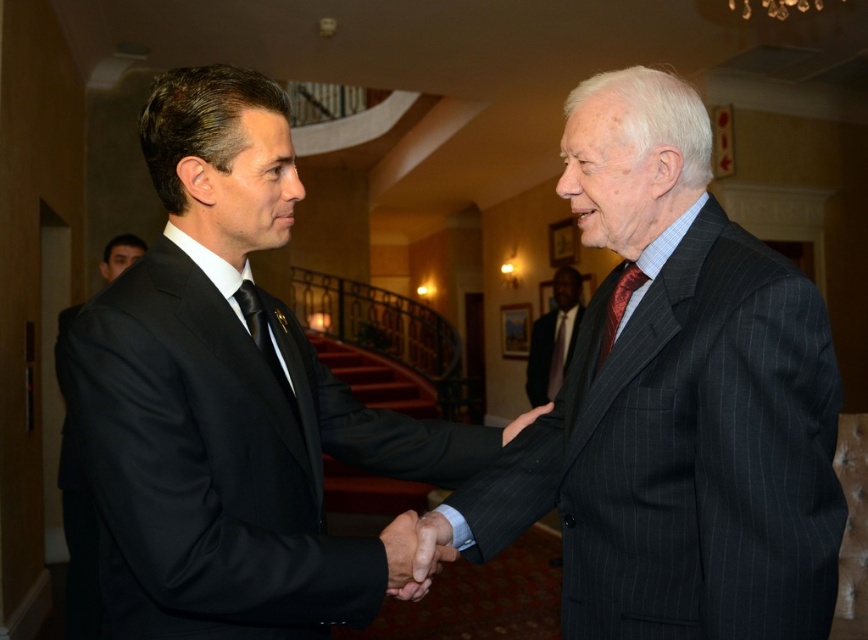
You are standing in the room and want to determine which of the two points, point (408, 528) or point (525, 416), is closer to you. Based on the scene description, which point is nearer?

Point (408, 528) is closer to the camera than point (525, 416), so it is nearer to you.

You are a photographer at the back of the room. You want to take a clear photo of the smooth leather hand at center and the black silk hand at center. Which hand will appear closer to the camera in the photo?

The smooth leather hand at center will appear closer to the camera in the photo because it is positioned in front of the black silk hand at center.